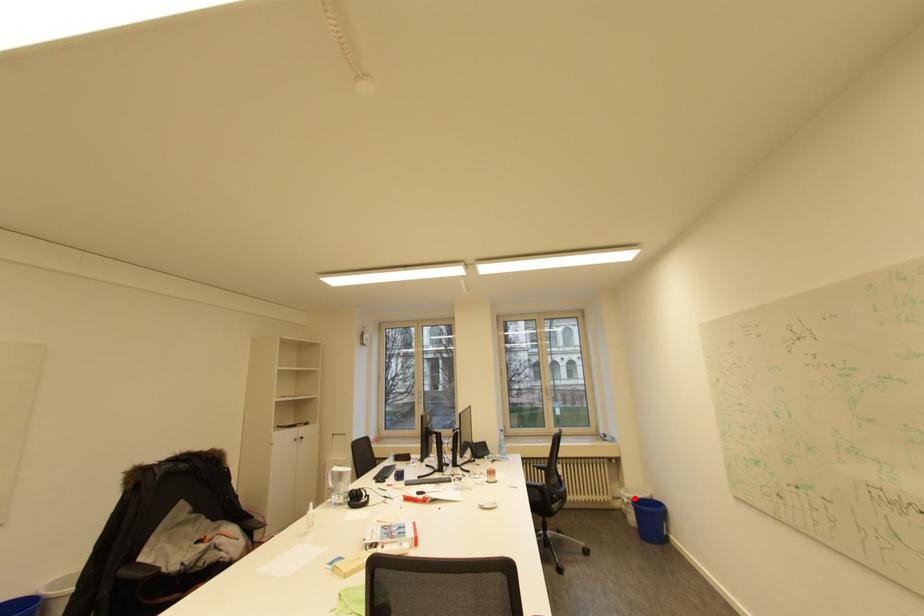
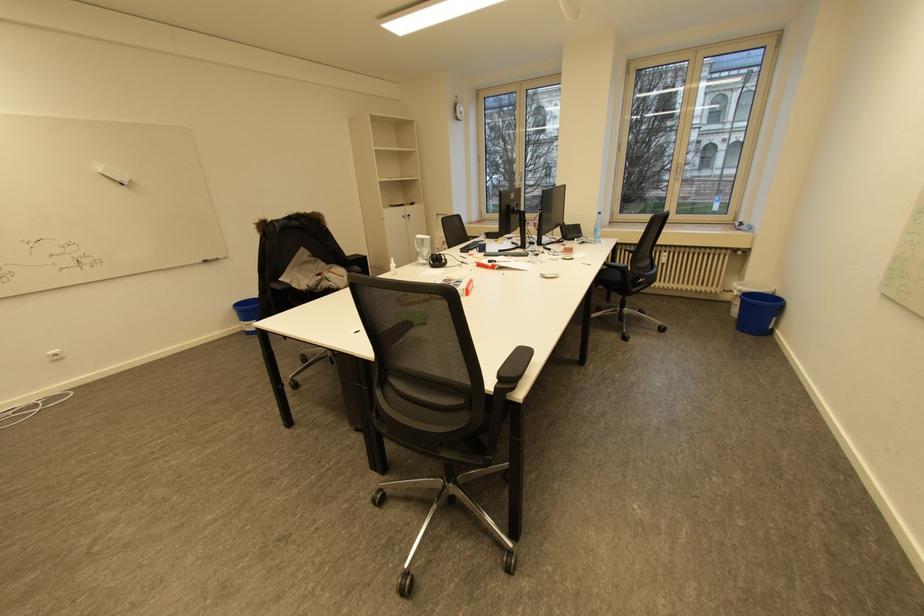
Find the pixel in the second image that matches the highlighted location in the first image.

(746, 292)